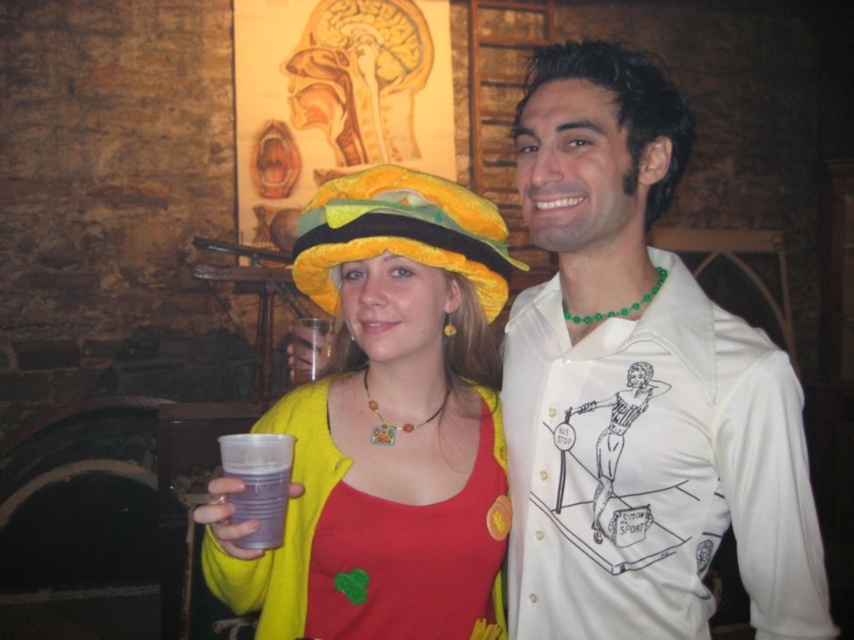
Question: Which point is farther to the camera?

Choices:
 (A) yellow fabric hat at center
 (B) fuzzy yellow hat at center

Answer: (B)

Question: Estimate the real-world distances between objects in this image. Which object is closer to the translucent plastic cup at lower center?

Choices:
 (A) yellow fabric hat at center
 (B) fuzzy yellow hat at center

Answer: (A)

Question: Which point is closer to the camera taking this photo?

Choices:
 (A) (344, 570)
 (B) (276, 528)
 (C) (325, 276)

Answer: (B)

Question: Can you confirm if white glossy shirt at center is wider than yellow fabric hat at center?

Choices:
 (A) yes
 (B) no

Answer: (B)

Question: Can you confirm if yellow fabric hat at center is thinner than fuzzy yellow hat at center?

Choices:
 (A) no
 (B) yes

Answer: (A)

Question: Does white glossy shirt at center appear on the right side of fuzzy yellow hat at center?

Choices:
 (A) no
 (B) yes

Answer: (B)